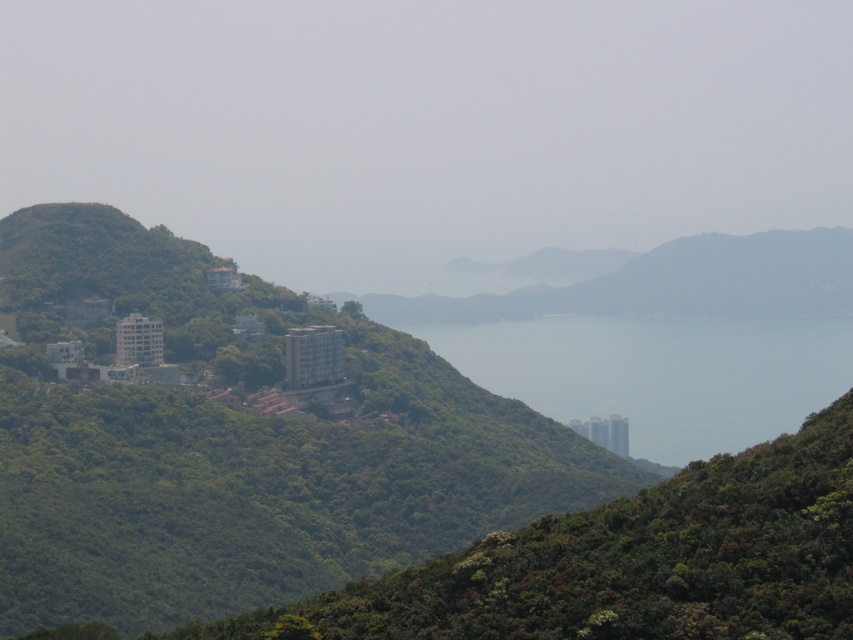
Question: Which is nearer to the green leafy mountain at center?

Choices:
 (A) transparent blue water at center
 (B) green leafy hillside at center

Answer: (A)

Question: Based on their relative distances, which object is nearer to the green leafy hillside at center?

Choices:
 (A) transparent blue water at center
 (B) green leafy mountain at center

Answer: (A)

Question: Does transparent blue water at center appear over green leafy mountain at center?

Choices:
 (A) no
 (B) yes

Answer: (A)

Question: Does green leafy hillside at center appear on the right side of transparent blue water at center?

Choices:
 (A) yes
 (B) no

Answer: (B)

Question: Can you confirm if green leafy hillside at center is thinner than transparent blue water at center?

Choices:
 (A) no
 (B) yes

Answer: (A)

Question: Among these points, which one is nearest to the camera?

Choices:
 (A) (190, 369)
 (B) (825, 260)

Answer: (A)